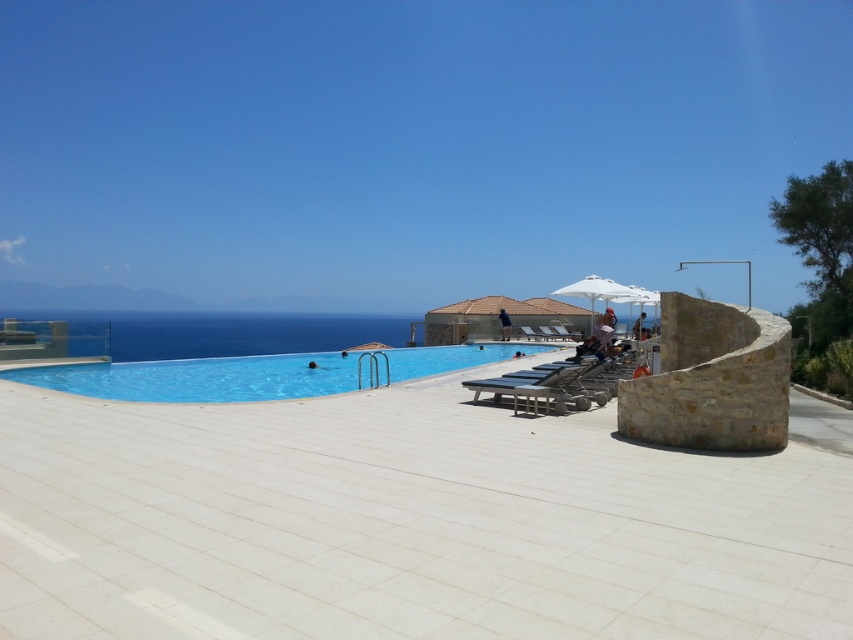
Question: Estimate the real-world distances between objects in this image. Which object is closer to the blue glossy pool at center?

Choices:
 (A) white fabric umbrella at center
 (B) white fabric umbrella at upper center

Answer: (A)

Question: Can you confirm if blue glossy pool at center is positioned below white fabric umbrella at center?

Choices:
 (A) no
 (B) yes

Answer: (B)

Question: Which point is farther from the camera taking this photo?

Choices:
 (A) (297, 387)
 (B) (612, 284)
 (C) (628, 285)

Answer: (C)

Question: Does white fabric umbrella at center have a larger size compared to white fabric umbrella at upper center?

Choices:
 (A) yes
 (B) no

Answer: (B)

Question: Which of the following is the farthest from the observer?

Choices:
 (A) white fabric umbrella at upper center
 (B) white fabric umbrella at center
 (C) blue glossy pool at center

Answer: (B)

Question: Is blue glossy pool at center smaller than white fabric umbrella at upper center?

Choices:
 (A) no
 (B) yes

Answer: (B)